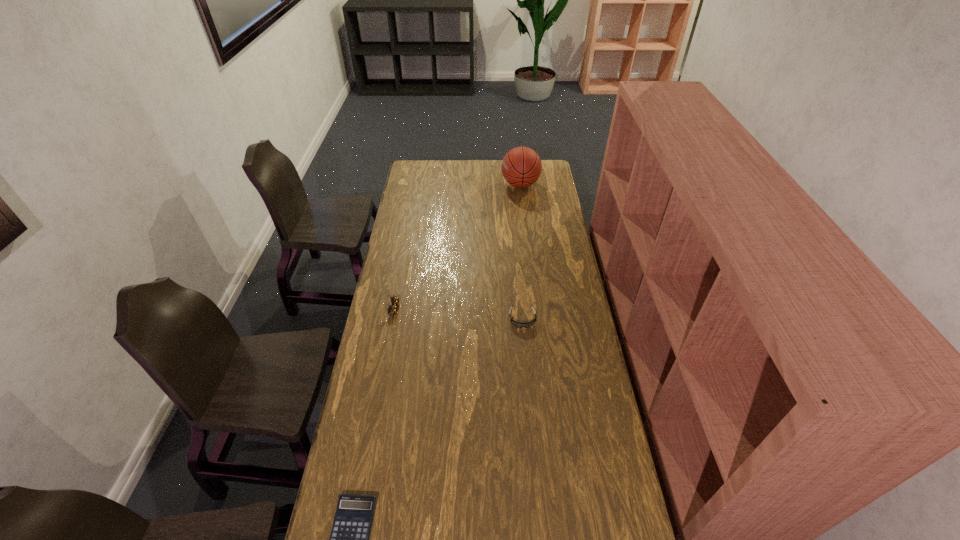
Find the location of `free space located on the front and sides of the right goggles`. free space located on the front and sides of the right goggles is located at coordinates (524, 346).

In order to click on object that is at the far edge in this screenshot , I will do click(x=521, y=167).

Locate an element on the screen. This screenshot has width=960, height=540. object that is at the left edge is located at coordinates (392, 309).

In order to click on object that is at the right edge in this screenshot , I will do `click(521, 167)`.

The height and width of the screenshot is (540, 960). Identify the location of object at the far right corner. (521, 167).

At what (x,y) coordinates should I click in order to perform the action: click on free space at the left edge of the desktop. Please return your answer as a coordinate pair (x, y). Looking at the image, I should click on (382, 339).

Locate an element on the screen. The image size is (960, 540). vacant space at the right edge of the desktop is located at coordinates (583, 381).

This screenshot has width=960, height=540. I want to click on vacant space that is in between the taller goggles and the shorter goggles, so click(457, 314).

Locate an element on the screen. free area in between the taller goggles and the basketball is located at coordinates (456, 247).

You are a GUI agent. You are given a task and a screenshot of the screen. Output one action in this format:
    pyautogui.click(x=<x>, y=<y>)
    Task: Click on the vacant area that lies between the farthest object and the right goggles
    The height and width of the screenshot is (540, 960).
    Given the screenshot: What is the action you would take?
    pyautogui.click(x=521, y=252)